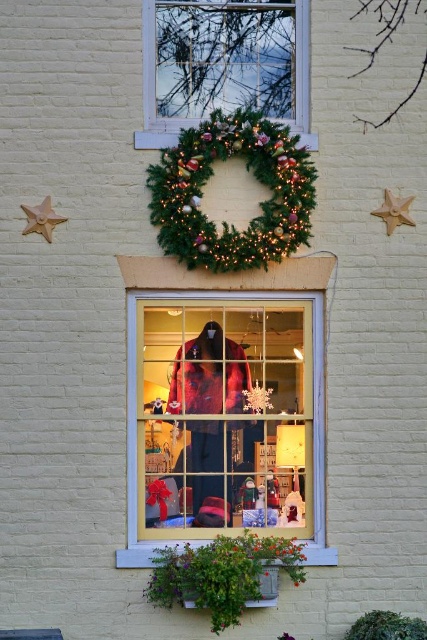
You are a customer looking to buy a gift for someone who loves holiday decorations. You see the velvet red coat at center and the gold matte star at upper left in the storefront window. Which item would you choose if you want to give a larger gift?

The velvet red coat at center is bigger than the gold matte star at upper left, so you should choose the velvet red coat at center for a larger gift.

You are a window shopper looking at the storefront. You notice the velvet red coat at center and the gold matte star at upper left. Which object is taller?

The velvet red coat at center is taller than the gold matte star at upper left.

You are a customer standing outside the storefront window. You see the green garland at upper center marked by point (x=154, y=92). Where is this garland located relative to the festive wreath at the top of the window?

The green garland at upper center marked by point (x=154, y=92) is located below the festive wreath at the top of the window.